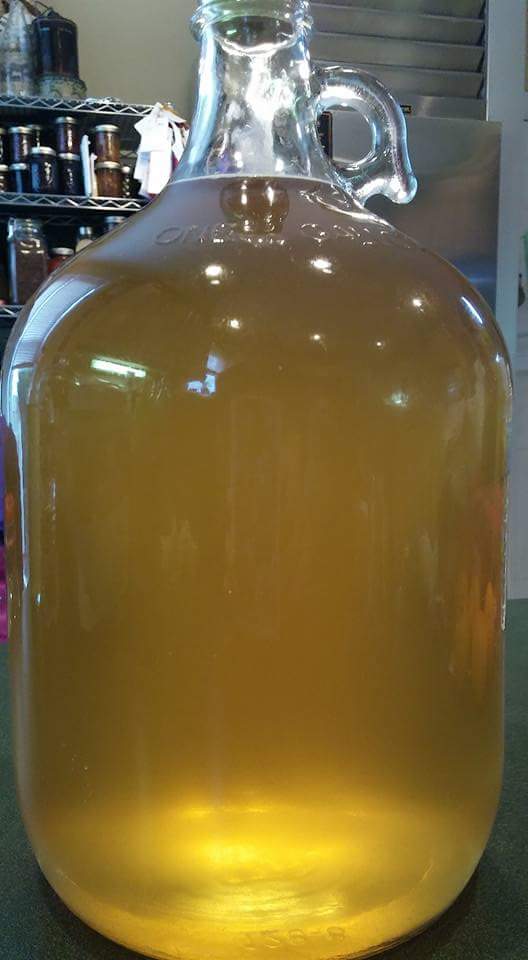
Locate an element on the screen. This screenshot has width=528, height=960. jars is located at coordinates (210, 912), (99, 128), (112, 175), (76, 173), (64, 131), (47, 165), (13, 142), (21, 172), (55, 257).